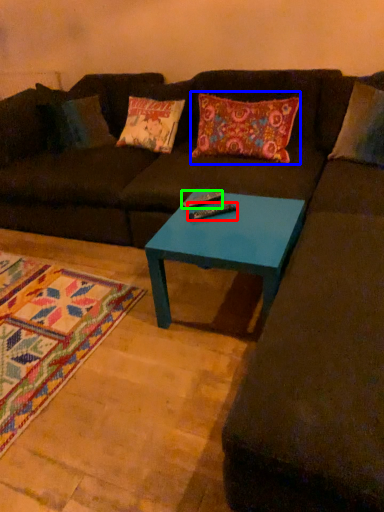
Question: Which object is positioned closest to remote (highlighted by a red box)? Select from throw pillow (highlighted by a blue box) and remote (highlighted by a green box).

Choices:
 (A) throw pillow
 (B) remote

Answer: (B)